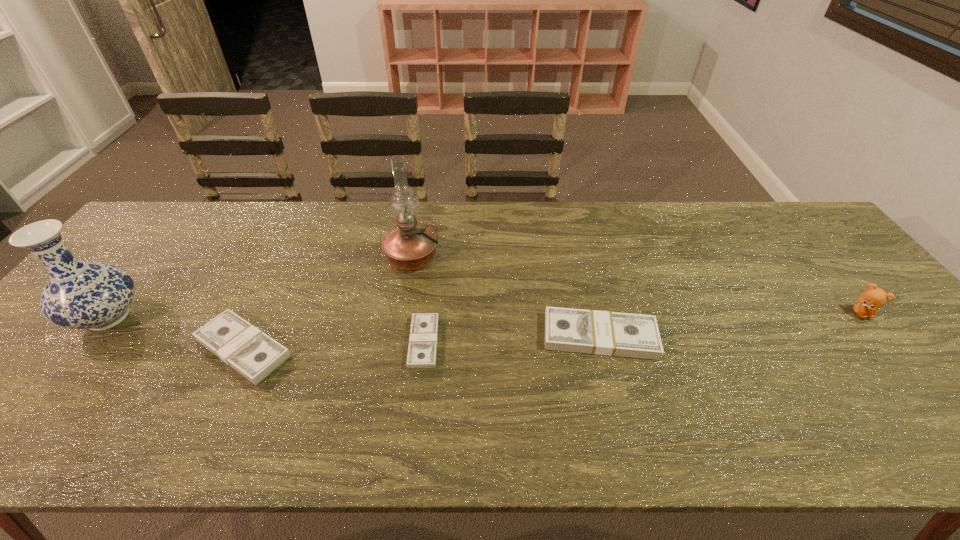
Find the location of `the second shortest object`. the second shortest object is located at coordinates (252, 353).

Locate an element on the screen. The width and height of the screenshot is (960, 540). the fifth object from right to left is located at coordinates (252, 353).

Where is `the second dollar from right to left`? The image size is (960, 540). the second dollar from right to left is located at coordinates (422, 349).

This screenshot has width=960, height=540. I want to click on the shortest dollar, so click(422, 349).

The image size is (960, 540). Identify the location of the rightmost dollar. (608, 333).

Image resolution: width=960 pixels, height=540 pixels. What are the coordinates of `oil lamp` in the screenshot? It's located at (408, 247).

You are a GUI agent. You are given a task and a screenshot of the screen. Output one action in this format:
    pyautogui.click(x=<x>, y=<y>)
    Task: Click on the vase
    The width and height of the screenshot is (960, 540).
    Given the screenshot: What is the action you would take?
    pyautogui.click(x=79, y=295)

Identify the location of the fifth shortest object. (79, 295).

You are a GUI agent. You are given a task and a screenshot of the screen. Output one action in this format:
    pyautogui.click(x=<x>, y=<y>)
    Task: Click on the rightmost object
    This screenshot has width=960, height=540.
    Given the screenshot: What is the action you would take?
    pyautogui.click(x=870, y=300)

Locate an element on the screen. The width and height of the screenshot is (960, 540). teddy bear is located at coordinates (870, 300).